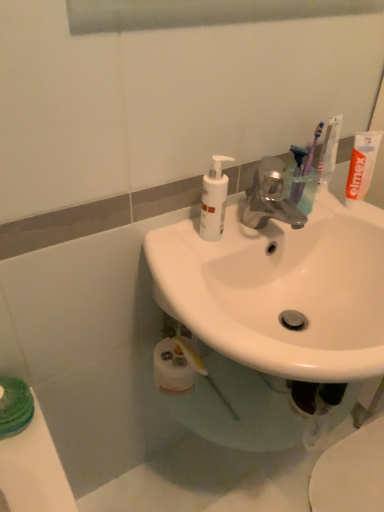
Identify the location of vacant area in front of purple plastic toothbrush at upper right, the 1th toothbrush from the right. The image size is (384, 512). (322, 214).